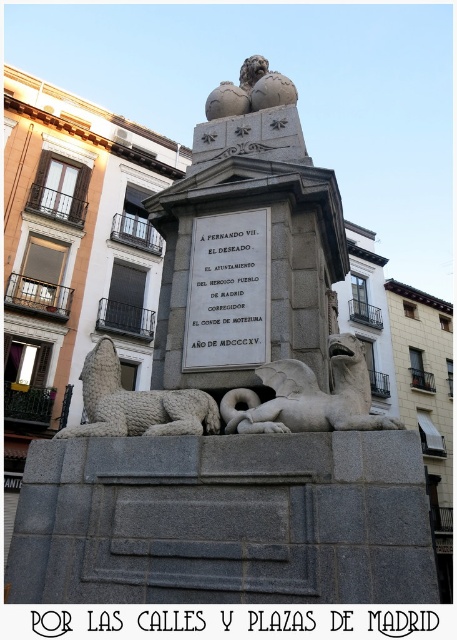
Between point (192, 342) and point (259, 60), which one is positioned in front?

Positioned in front is point (192, 342).

Locate an element on the screen. white stone plaque at center is located at coordinates (228, 291).

Locate an element on the screen. The image size is (457, 640). white stone plaque at center is located at coordinates (228, 291).

Between point (291, 380) and point (64, 433), which one is positioned behind?

Positioned behind is point (64, 433).

Does point (254, 426) come in front of point (101, 394)?

Yes, point (254, 426) is closer to viewer.

Is point (338, 364) more distant than point (207, 426)?

No, it is not.

Identify the location of white stone gryphon at lower center. This screenshot has height=640, width=457. (308, 396).

This screenshot has height=640, width=457. Describe the element at coordinates (228, 291) in the screenshot. I see `white stone plaque at center` at that location.

Does white stone plaque at center have a greater width compared to white stone lion at lower left?

In fact, white stone plaque at center might be narrower than white stone lion at lower left.

Who is more distant from viewer, (212, 314) or (111, 429)?

Point (212, 314)

You are a GUI agent. You are given a task and a screenshot of the screen. Output one action in this format:
    pyautogui.click(x=<x>, y=<y>)
    Task: Click on the white stone plaque at center
    The image size is (457, 640).
    Given the screenshot: What is the action you would take?
    pyautogui.click(x=228, y=291)